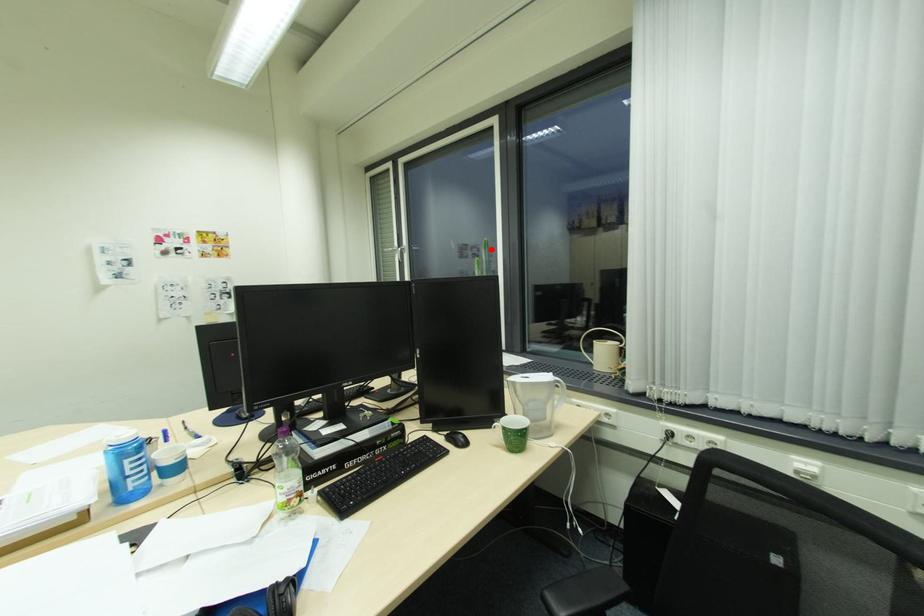
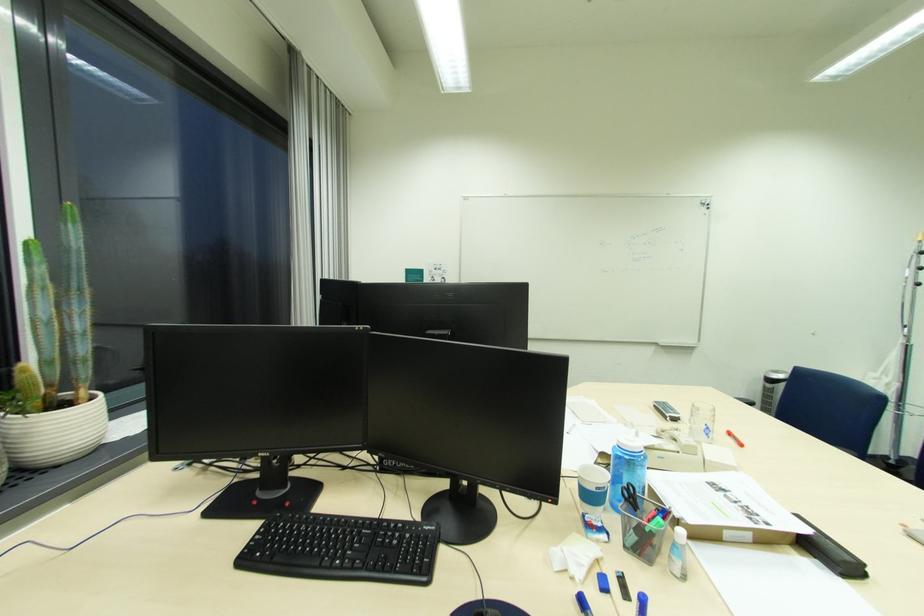
Question: I am providing you with two images of the same scene from different viewpoints. A red point is marked on the first image. Can you still see the location of the red point in image 2?

Choices:
 (A) Yes
 (B) No

Answer: (A)